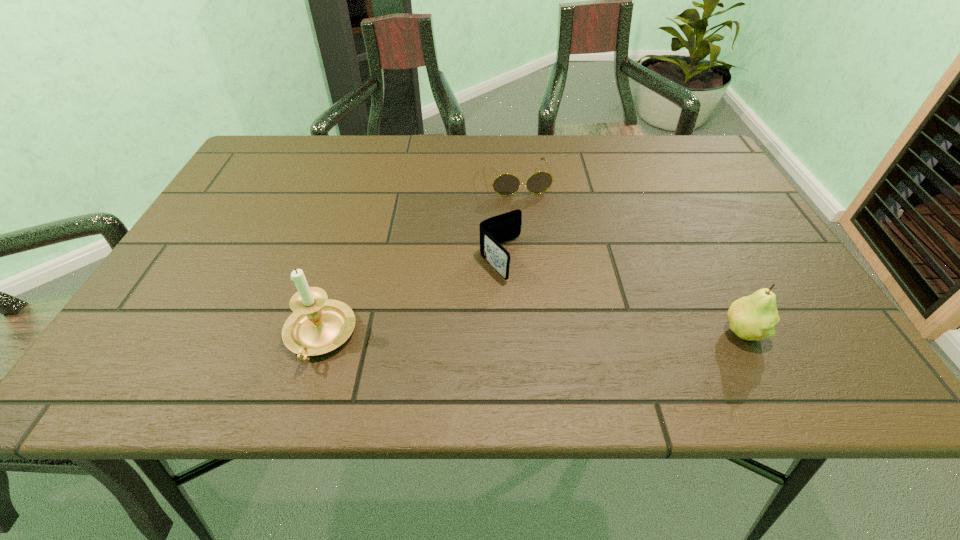
Find the location of a particular element. free spot between the second farthest object and the pear is located at coordinates [x=622, y=295].

Find the location of `vacant space in between the third nearest object and the leftmost object`. vacant space in between the third nearest object and the leftmost object is located at coordinates tap(410, 298).

Select which object is the second closest to the pear. Please provide its 2D coordinates. Your answer should be formatted as a tuple, i.e. [(x, y)], where the tuple contains the x and y coordinates of a point satisfying the conditions above.

[(506, 184)]

This screenshot has width=960, height=540. In order to click on object that is the second closest to the candle holder in this screenshot , I will do `click(506, 184)`.